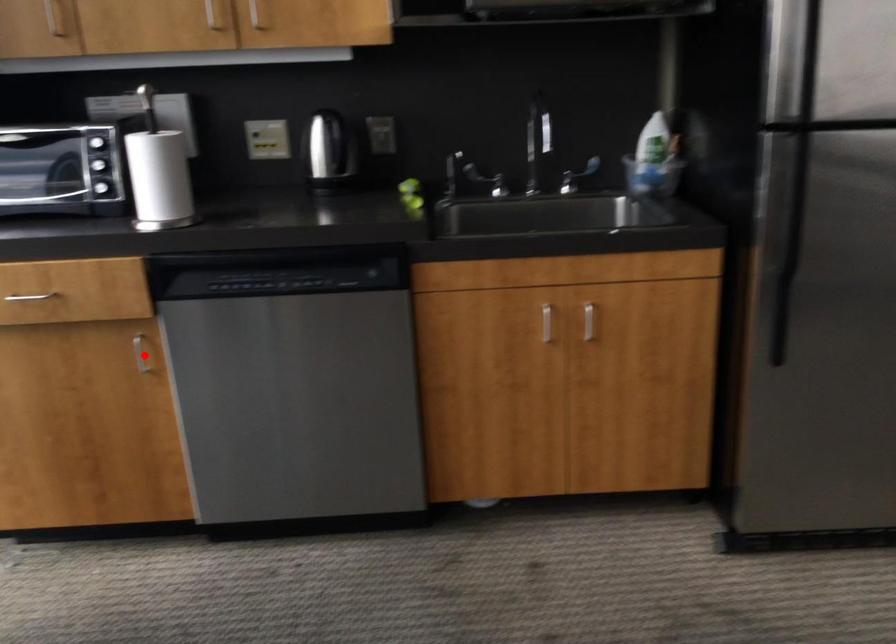
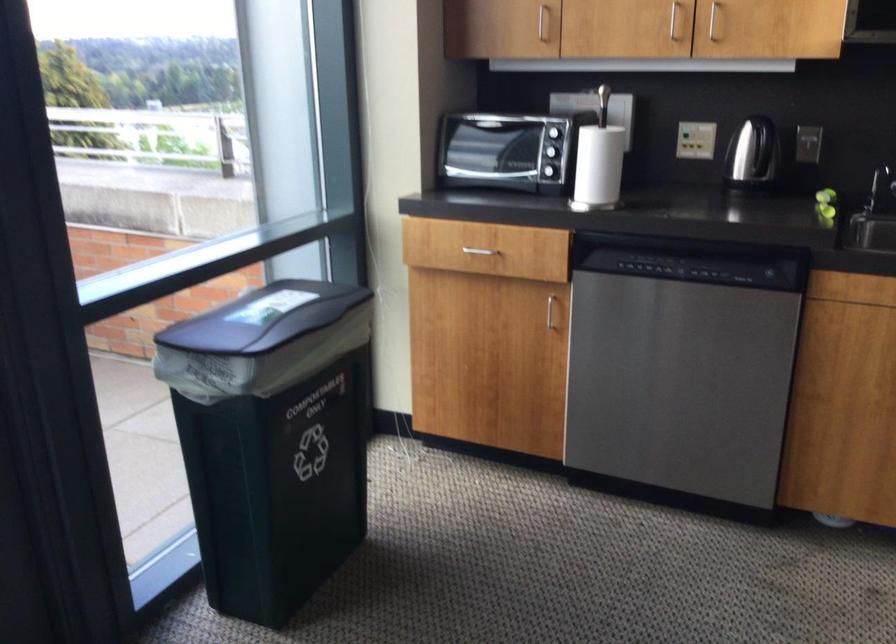
Locate, in the second image, the point that corresponds to the highlighted location in the first image.

(549, 310)